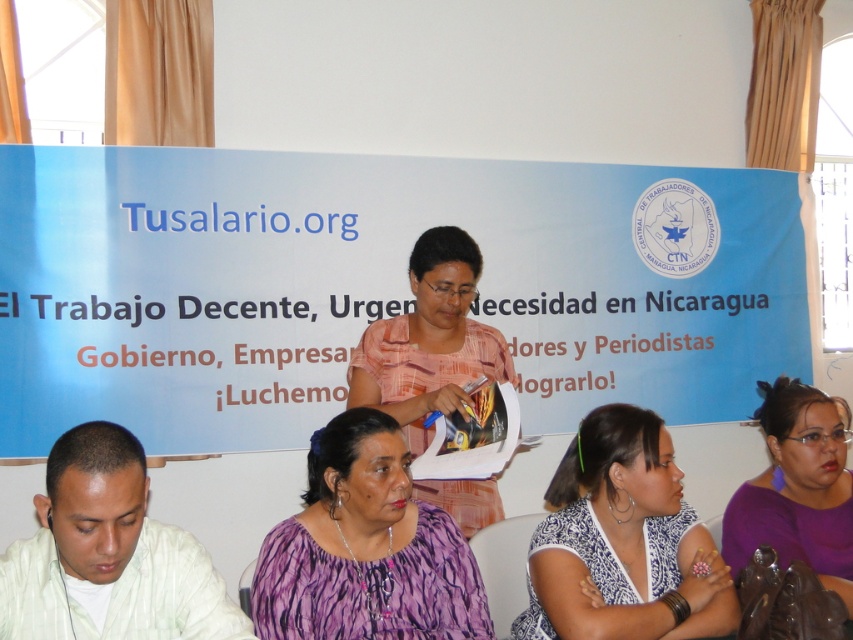
You are organizing a photo shoot and need to ensure that the white matte shirt at lower left and the pink fabric at center are visible in the final image. Given their sizes, which object might require more careful positioning to avoid being overshadowed?

The white matte shirt at lower left is thinner than the pink fabric at center, so it might require more careful positioning to avoid being overshadowed.